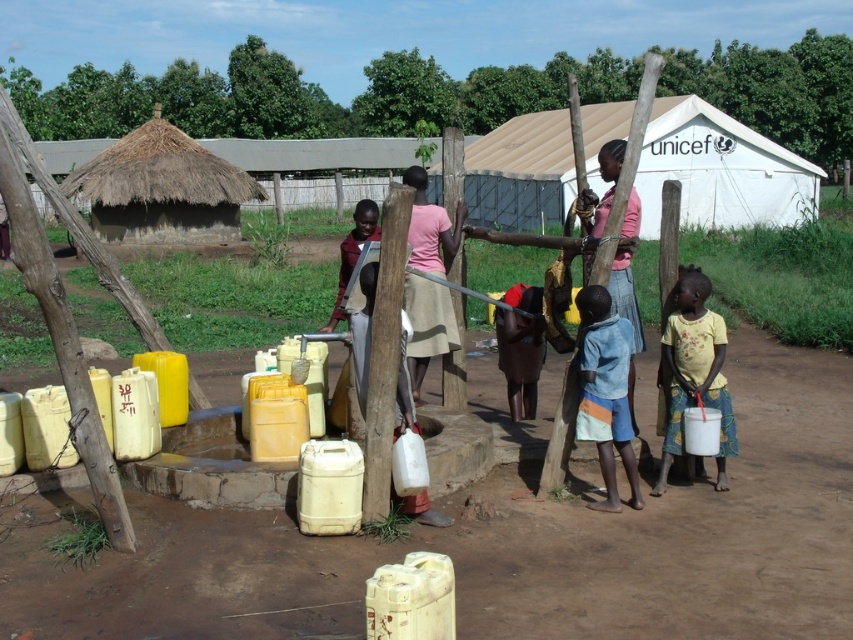
Can you confirm if blue denim skirt at center is wider than pink matte skirt at center?

No.

Who is shorter, blue denim skirt at center or pink matte skirt at center?

With less height is blue denim skirt at center.

Between point (612, 355) and point (440, 268), which one is positioned in front?

Point (612, 355)

Where is `blue denim skirt at center`? blue denim skirt at center is located at coordinates (606, 394).

Is white canvas tent at upper center above blue denim skirt at center?

Yes, white canvas tent at upper center is above blue denim skirt at center.

Measure the distance between white canvas tent at upper center and blue denim skirt at center.

12.65 meters

Which is behind, point (512, 122) or point (601, 417)?

The point (512, 122) is more distant.

Identify the location of white canvas tent at upper center. This screenshot has height=640, width=853. (720, 170).

Is white canvas tent at upper center bigger than pink matte skirt at center?

Indeed, white canvas tent at upper center has a larger size compared to pink matte skirt at center.

Is white canvas tent at upper center in front of pink matte skirt at center?

No, white canvas tent at upper center is behind pink matte skirt at center.

Describe the element at coordinates (720, 170) in the screenshot. I see `white canvas tent at upper center` at that location.

I want to click on white canvas tent at upper center, so click(720, 170).